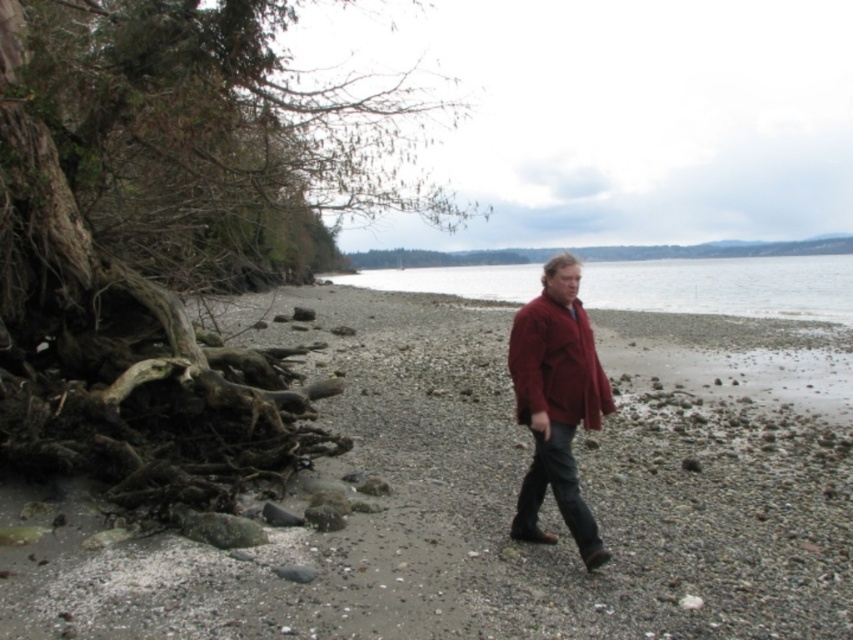
Is point (708, 340) behind point (219, 97)?

That is True.

Does smooth pebbles at center appear over brown textured roots at left?

Actually, smooth pebbles at center is below brown textured roots at left.

Between point (320, 339) and point (259, 243), which one is positioned behind?

The point (259, 243) is more distant.

The width and height of the screenshot is (853, 640). Identify the location of smooth pebbles at center. (480, 512).

Can you confirm if smooth pebbles at center is positioned above smooth water at center?

No, smooth pebbles at center is not above smooth water at center.

The image size is (853, 640). What are the coordinates of `smooth pebbles at center` in the screenshot? It's located at (480, 512).

Locate an element on the screen. The image size is (853, 640). smooth pebbles at center is located at coordinates (480, 512).

Can you confirm if brown textured roots at left is taller than smooth water at center?

In fact, brown textured roots at left may be shorter than smooth water at center.

Who is more distant from viewer, (129, 184) or (805, 289)?

The point (805, 289) is more distant.

Where is `brown textured roots at left`? The height and width of the screenshot is (640, 853). brown textured roots at left is located at coordinates (151, 241).